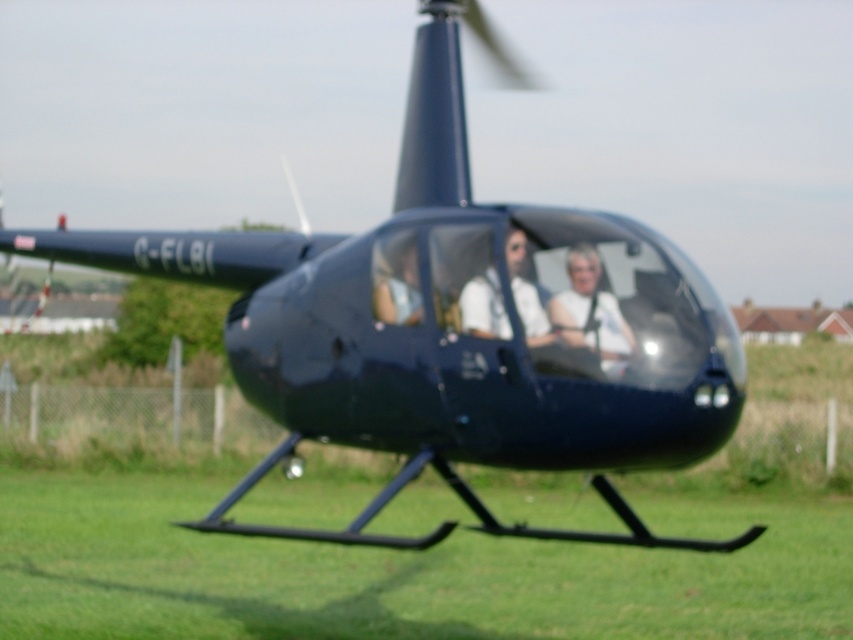
Who is taller, white glossy shirt at center or matte white shirt at center?

Standing taller between the two is white glossy shirt at center.

Is white glossy shirt at center to the left of matte white shirt at center from the viewer's perspective?

No, white glossy shirt at center is not to the left of matte white shirt at center.

Is point (497, 332) farther from viewer compared to point (404, 288)?

No.

What are the coordinates of `white glossy shirt at center` in the screenshot? It's located at (485, 307).

Is green grass at lower center above white glossy shirt at center?

Incorrect, green grass at lower center is not positioned above white glossy shirt at center.

Who is taller, green grass at lower center or white glossy shirt at center?

white glossy shirt at center is taller.

Does point (337, 627) come farther from viewer compared to point (543, 326)?

That is True.

Locate an element on the screen. green grass at lower center is located at coordinates (403, 572).

Measure the distance between white matte shirt at center and camera.

white matte shirt at center and camera are 28.70 feet apart.

Is white matte shirt at center in front of white glossy shirt at center?

Yes, white matte shirt at center is in front of white glossy shirt at center.

Is point (598, 272) farther from viewer compared to point (503, 324)?

Yes, it is behind point (503, 324).

At what (x,y) coordinates should I click in order to perform the action: click on white matte shirt at center. Please return your answer as a coordinate pair (x, y). Image resolution: width=853 pixels, height=640 pixels. Looking at the image, I should click on (590, 312).